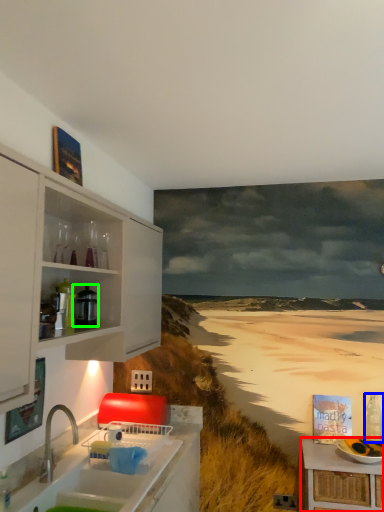
Question: Which object is positioned farthest from table (highlighted by a red box)? Select from bottle (highlighted by a blue box) and appliance (highlighted by a green box).

Choices:
 (A) bottle
 (B) appliance

Answer: (B)